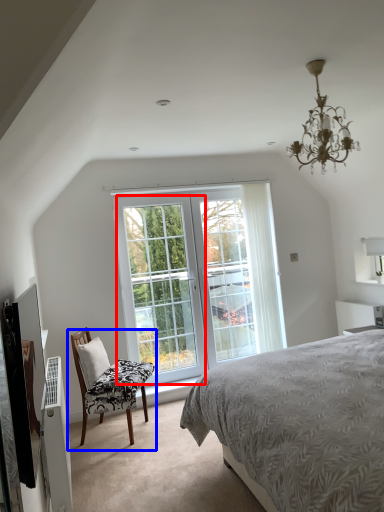
Question: Among these objects, which one is nearest to the camera, window (highlighted by a red box) or chair (highlighted by a blue box)?

Choices:
 (A) window
 (B) chair

Answer: (B)